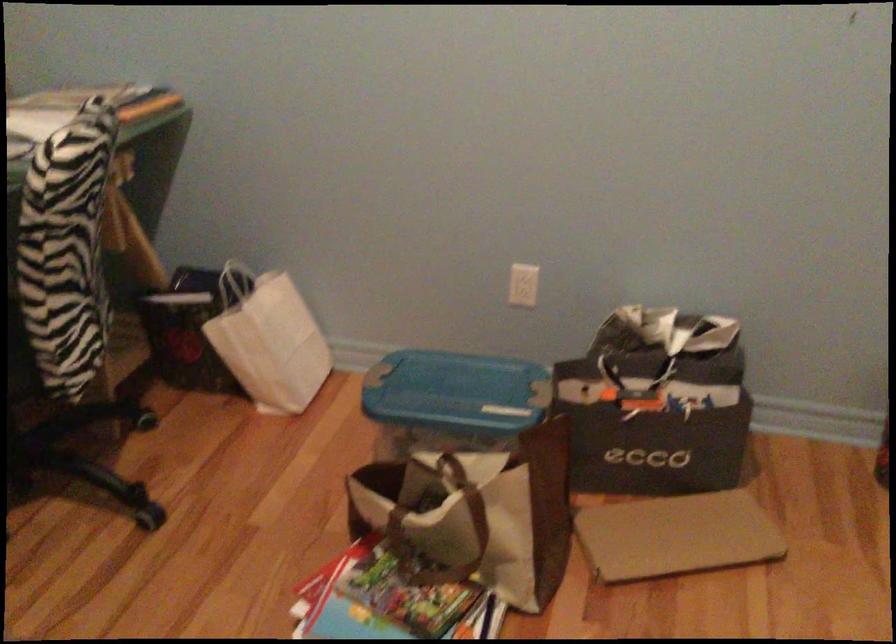
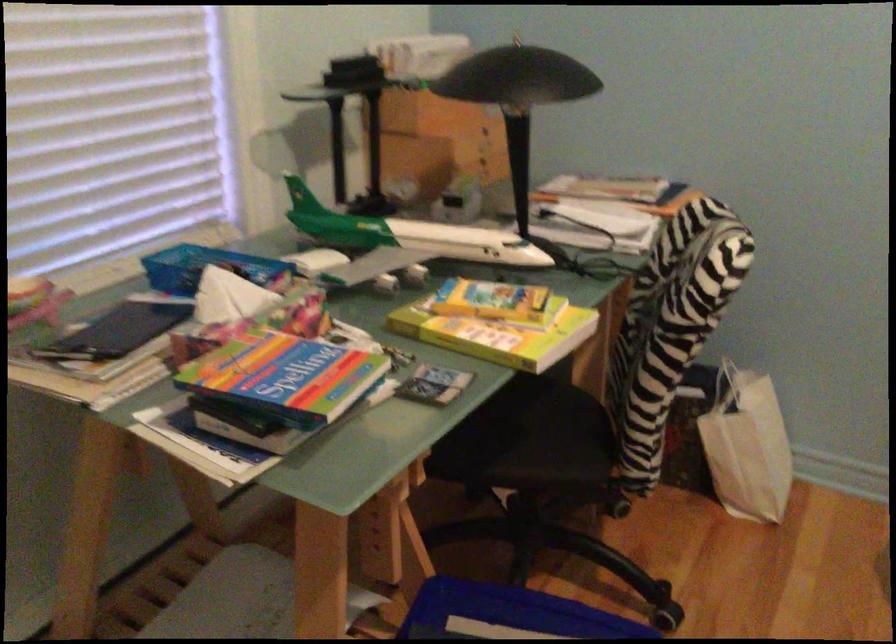
Find the pixel in the second image that matches (251,345) in the first image.

(746, 446)